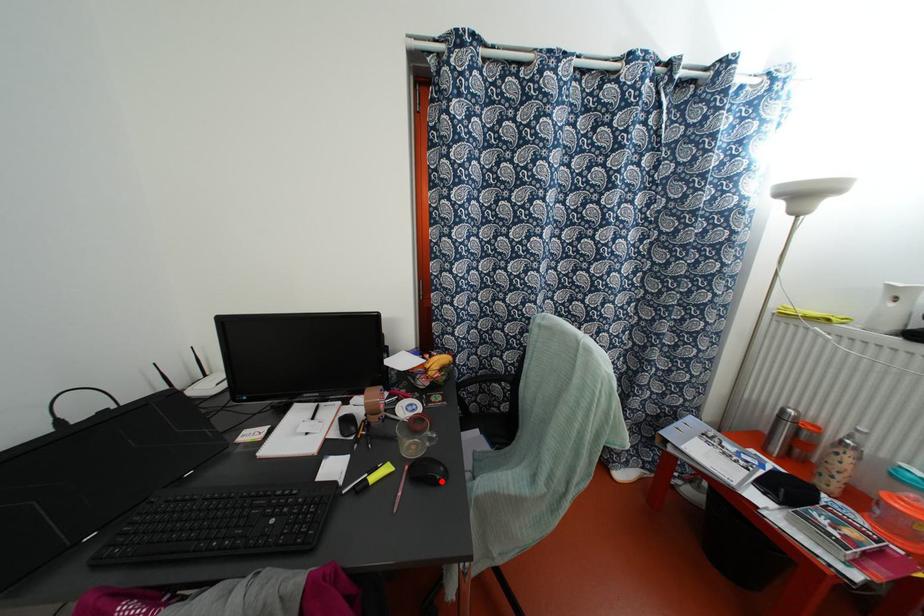
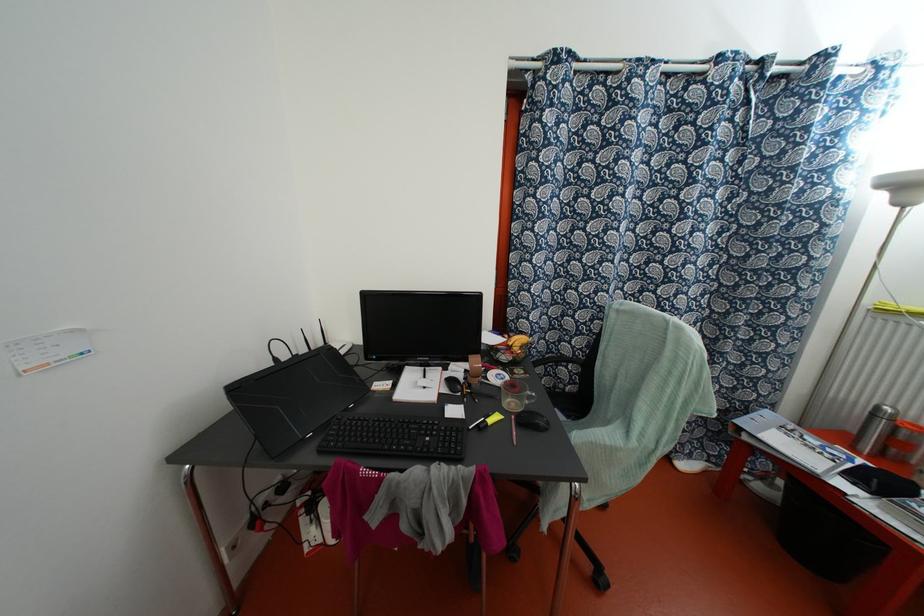
The point at the highlighted location is marked in the first image. Where is the corresponding point in the second image?

(545, 429)